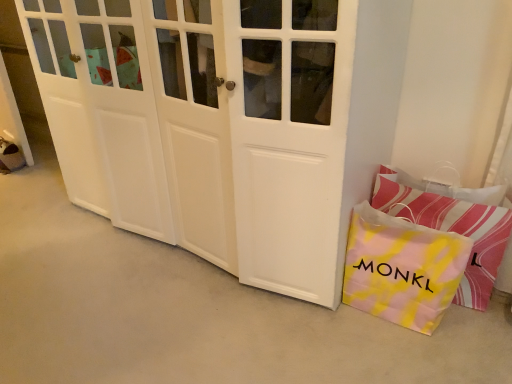
I want to click on free space above yellow tie-dye paper bag at lower right (from a real-world perspective), so click(402, 224).